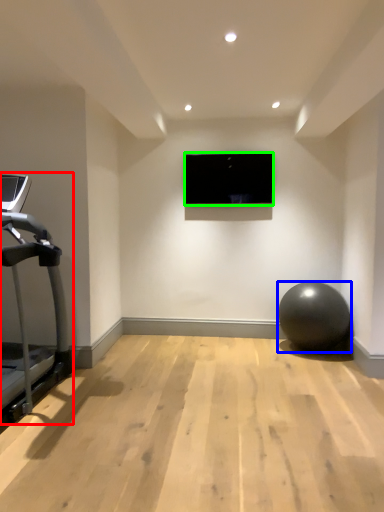
Question: Based on their relative distances, which object is farther from treadmill (highlighted by a red box)? Choose from ball (highlighted by a blue box) and computer screen (highlighted by a green box).

Choices:
 (A) ball
 (B) computer screen

Answer: (A)